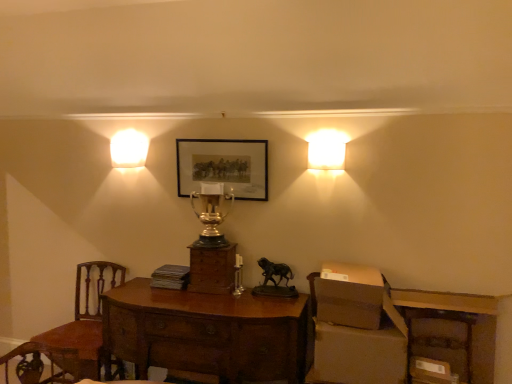
At what (x,y) coordinates should I click in order to perform the action: click on vacant area on top of matte white square at upper right, the 2th lamp viewed from the back (from a real-world perspective). Please return your answer as a coordinate pair (x, y). Looking at the image, I should click on (325, 141).